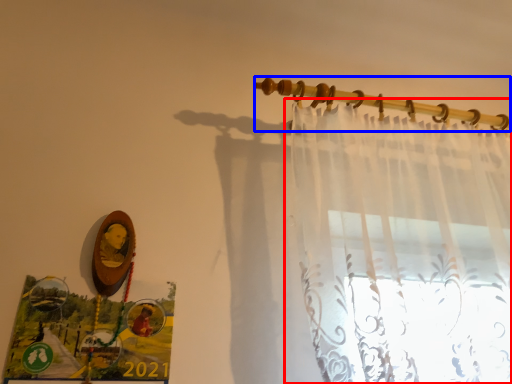
Question: Which object is closer to the camera taking this photo, curtain (highlighted by a red box) or clothesline (highlighted by a blue box)?

Choices:
 (A) curtain
 (B) clothesline

Answer: (A)